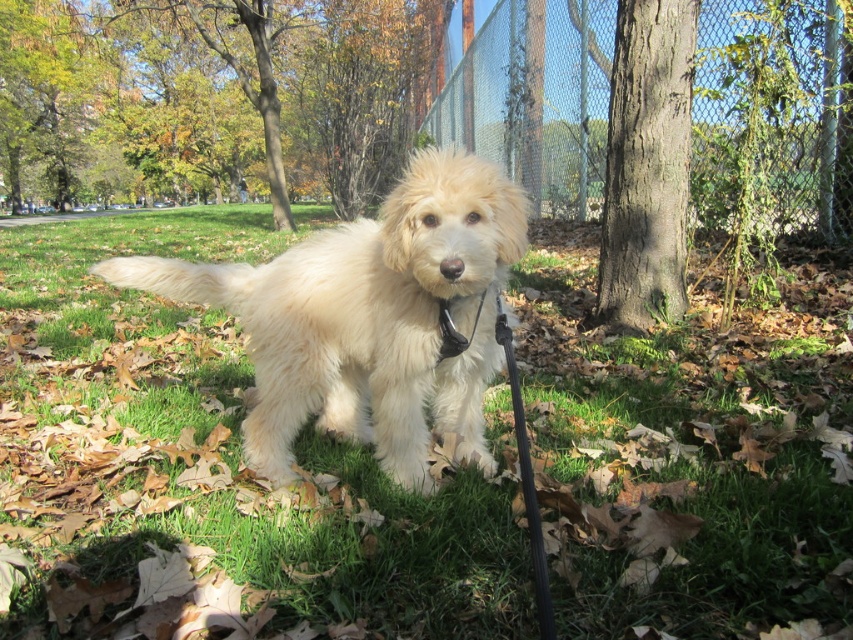
Question: Which of these objects is positioned closest to the green grass at center?

Choices:
 (A) fluffy white dog at center
 (B) metallic chain-link fence at center-right
 (C) black leather neckband at center

Answer: (A)

Question: Based on their relative distances, which object is farther from the metallic chain-link fence at center-right?

Choices:
 (A) fluffy white dog at center
 (B) black leather neckband at center

Answer: (B)

Question: Can you confirm if green grass at center is positioned to the left of metallic chain-link fence at center-right?

Choices:
 (A) no
 (B) yes

Answer: (B)

Question: Does fluffy white dog at center appear over black leather neckband at center?

Choices:
 (A) yes
 (B) no

Answer: (B)

Question: Is green grass at center to the left of fluffy white dog at center from the viewer's perspective?

Choices:
 (A) yes
 (B) no

Answer: (A)

Question: Which is farther from the metallic chain-link fence at center-right?

Choices:
 (A) black leather neckband at center
 (B) green grass at center
 (C) fluffy white dog at center

Answer: (A)